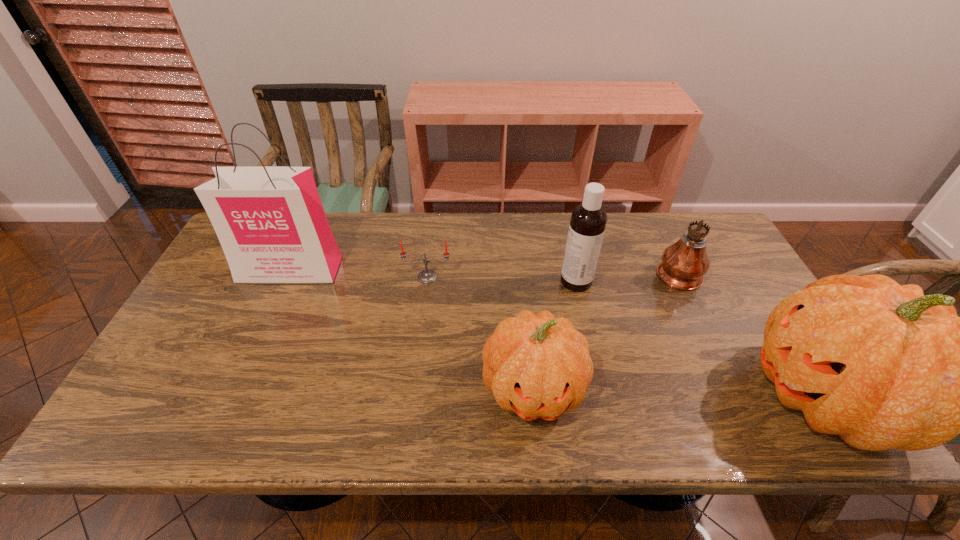
Locate an element on the screen. This screenshot has height=540, width=960. vacant region located 0.220m on the front-facing side of the fifth object from right to left is located at coordinates (420, 344).

This screenshot has width=960, height=540. I want to click on vacant space located 0.050m on the label side of the dishwasher detergent, so click(543, 281).

You are a GUI agent. You are given a task and a screenshot of the screen. Output one action in this format:
    pyautogui.click(x=<x>, y=<y>)
    Task: Click on the free point located on the label side of the dishwasher detergent
    The height and width of the screenshot is (540, 960).
    Given the screenshot: What is the action you would take?
    pyautogui.click(x=424, y=281)

This screenshot has width=960, height=540. In order to click on free point located 0.350m on the label side of the dishwasher detergent in this screenshot , I will do `click(442, 281)`.

Identify the location of oil lamp that is at the far edge. (684, 263).

The image size is (960, 540). In order to click on shopping bag positioned at the far edge in this screenshot , I will do `click(270, 222)`.

This screenshot has width=960, height=540. What are the coordinates of `object that is positioned at the near edge` in the screenshot? It's located at (538, 366).

You are a GUI agent. You are given a task and a screenshot of the screen. Output one action in this format:
    pyautogui.click(x=<x>, y=<y>)
    Task: Click on the object that is at the left edge
    The height and width of the screenshot is (540, 960).
    Given the screenshot: What is the action you would take?
    pyautogui.click(x=270, y=222)

Find the location of a particular element. The height and width of the screenshot is (540, 960). object that is at the right edge is located at coordinates pos(684,263).

At what (x,y) coordinates should I click in order to perform the action: click on object situated at the far left corner. Please return your answer as a coordinate pair (x, y). The image size is (960, 540). Looking at the image, I should click on (270, 222).